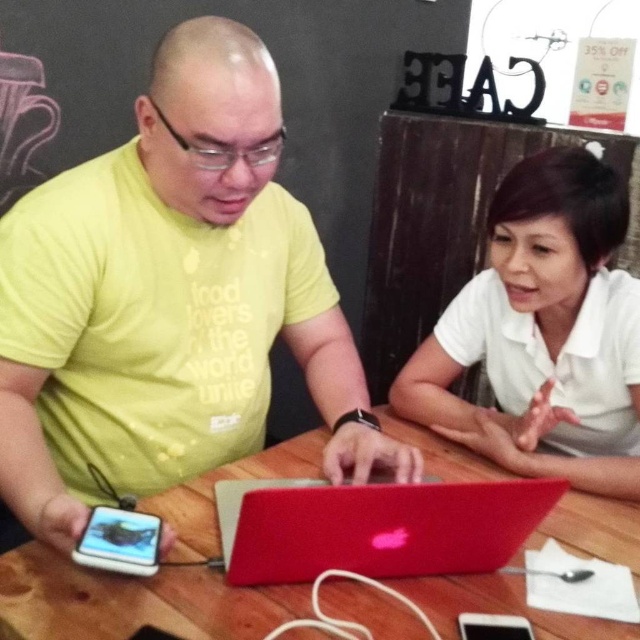
Who is more forward, (88, 307) or (93, 541)?

Point (93, 541) is in front.

Based on the photo, who is lower down, matte yellow t-shirt at center or matte black phone at lower left?

matte black phone at lower left is below.

Is point (166, 92) in front of point (104, 536)?

That is False.

Image resolution: width=640 pixels, height=640 pixels. Find the location of `matte yellow t-shirt at center`. matte yellow t-shirt at center is located at coordinates (170, 292).

Does white matte shirt at center appear over metallic red laptop at center?

Indeed, white matte shirt at center is positioned over metallic red laptop at center.

Who is positioned more to the left, white matte shirt at center or metallic red laptop at center?

From the viewer's perspective, metallic red laptop at center appears more on the left side.

You are a GUI agent. You are given a task and a screenshot of the screen. Output one action in this format:
    pyautogui.click(x=<x>, y=<y>)
    Task: Click on the white matte shirt at center
    Image resolution: width=640 pixels, height=640 pixels.
    Given the screenshot: What is the action you would take?
    pyautogui.click(x=544, y=332)

Which of these two, matte black phone at lower left or black matte smartphone at lower center, stands taller?

matte black phone at lower left is taller.

Image resolution: width=640 pixels, height=640 pixels. In order to click on matte black phone at lower left in this screenshot , I will do `click(120, 541)`.